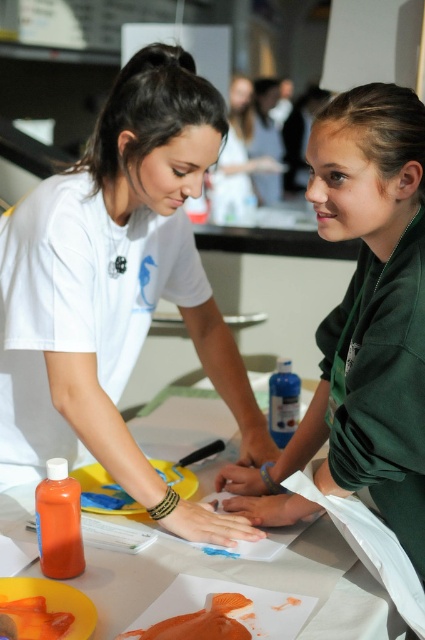
You are a photographer setting up a shoot in this workshop. You need to position a light source so it illuminates both the matte white shirt at center and the orange matte food at lower left equally. Given their height difference, where should you place the light source relative to them?

The matte white shirt at center is taller than the orange matte food at lower left, so to ensure equal illumination, the light source should be placed higher above them so that the light can reach both objects at the same intensity.

You are a chef who needs to reach the orange matte food at lower left during a cooking demonstration. There is a matte white shirt at center in your way. Can you move around it to access the food?

The matte white shirt at center is positioned over the orange matte food at lower left, so you cannot directly access the food without moving the shirt first.